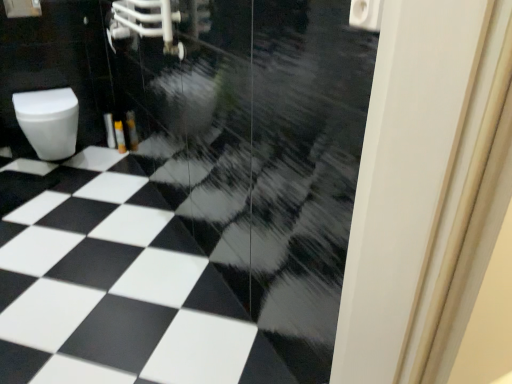
What do you see at coordinates (412, 178) in the screenshot?
I see `white glossy door at right` at bounding box center [412, 178].

Describe the element at coordinates (110, 285) in the screenshot. I see `black glossy tile at center` at that location.

Locate an element on the screen. white glossy door at right is located at coordinates (412, 178).

From a real-world perspective, is white glossy door at right located beneath white glossy toilet at left?

No, from a real-world perspective, white glossy door at right is not beneath white glossy toilet at left.

Is white glossy door at right to the right of white glossy toilet at left from the viewer's perspective?

Indeed, white glossy door at right is positioned on the right side of white glossy toilet at left.

Are white glossy door at right and white glossy toilet at left far apart?

white glossy door at right is far away from white glossy toilet at left.

Does point (383, 291) lie behind point (27, 107)?

No.

Is white glossy toilet at left oriented towards white glossy door at right?

Yes, white glossy toilet at left is turned towards white glossy door at right.

From the image's perspective, is white glossy toilet at left above or below white glossy door at right?

From the image's perspective, white glossy toilet at left appears above white glossy door at right.

Is white glossy toilet at left spatially inside white glossy door at right, or outside of it?

white glossy toilet at left is spatially situated outside white glossy door at right.

Is white glossy toilet at left to the right of white glossy door at right from the viewer's perspective?

No, white glossy toilet at left is not to the right of white glossy door at right.

Can you confirm if white glossy toilet at left is positioned to the left of black glossy tile at center?

Yes.

You are a GUI agent. You are given a task and a screenshot of the screen. Output one action in this format:
    pyautogui.click(x=<x>, y=<y>)
    Task: Click on the tile that is under the white glossy toilet at left (from a real-world perspective)
    The height and width of the screenshot is (384, 512).
    Given the screenshot: What is the action you would take?
    pyautogui.click(x=110, y=285)

Which of these two, white glossy toilet at left or black glossy tile at center, is thinner?

With smaller width is white glossy toilet at left.

Consider the image. From a real-world perspective, which object stands above the other?

white glossy toilet at left.

Is point (406, 78) positioned behind point (3, 286)?

No, (406, 78) is closer to viewer.

Is black glossy tile at center inside white glossy door at right?

No, white glossy door at right does not contain black glossy tile at center.

Is white glossy door at right smaller than black glossy tile at center?

Correct, white glossy door at right occupies less space than black glossy tile at center.

Can you confirm if white glossy door at right is shorter than black glossy tile at center?

No.

Which is in front, black glossy tile at center or white glossy toilet at left?

black glossy tile at center is more forward.

Considering the relative sizes of black glossy tile at center and white glossy toilet at left in the image provided, is black glossy tile at center shorter than white glossy toilet at left?

Indeed, black glossy tile at center has a lesser height compared to white glossy toilet at left.

Is black glossy tile at center far away from white glossy toilet at left?

That's not correct — black glossy tile at center is a little close to white glossy toilet at left.

From a real-world perspective, does black glossy tile at center sit lower than white glossy toilet at left?

Yes, from a real-world perspective, black glossy tile at center is below white glossy toilet at left.

From a real-world perspective, between white glossy toilet paper at upper right and white glossy door at right, who is vertically lower?

white glossy door at right, from a real-world perspective.

Considering their positions, is white glossy toilet paper at upper right located in front of or behind white glossy door at right?

white glossy toilet paper at upper right is behind white glossy door at right.

Looking at the image, does white glossy toilet paper at upper right seem bigger or smaller compared to white glossy door at right?

Considering their sizes, white glossy toilet paper at upper right takes up less space than white glossy door at right.

From the image's perspective, between black glossy tile at center and white glossy door at right, which one is located above?

white glossy door at right.

Where is `screen door on the right of black glossy tile at center`? The height and width of the screenshot is (384, 512). screen door on the right of black glossy tile at center is located at coordinates (412, 178).

Is black glossy tile at center smaller than white glossy door at right?

Actually, black glossy tile at center might be larger than white glossy door at right.

In the scene shown: Which of these two, black glossy tile at center or white glossy door at right, stands shorter?

black glossy tile at center.

Where is `toilet above the white glossy door at right (from the image's perspective)`? This screenshot has height=384, width=512. toilet above the white glossy door at right (from the image's perspective) is located at coordinates (49, 121).

The width and height of the screenshot is (512, 384). I want to click on toilet on the left of white glossy door at right, so click(x=49, y=121).

From the image, which object appears to be farther from white glossy toilet at left, white glossy toilet paper at upper right or white glossy door at right?

white glossy door at right.

In the scene shown: Which object lies nearer to the anchor point white glossy door at right, black glossy tile at center or white glossy toilet at left?

black glossy tile at center is closer to white glossy door at right.

From the image, which object appears to be farther from white glossy door at right, black glossy tile at center or white glossy toilet paper at upper right?

The object further to white glossy door at right is black glossy tile at center.

When comparing their distances from white glossy toilet at left, does black glossy tile at center or white glossy toilet paper at upper right seem closer?

black glossy tile at center is positioned closer to the anchor white glossy toilet at left.

Considering their positions, is white glossy door at right positioned closer to white glossy toilet at left than white glossy toilet paper at upper right?

The object closer to white glossy toilet at left is white glossy toilet paper at upper right.

Estimate the real-world distances between objects in this image. Which object is further from white glossy door at right, white glossy toilet paper at upper right or black glossy tile at center?

Among the two, black glossy tile at center is located further to white glossy door at right.

From the image, which object appears to be farther from black glossy tile at center, white glossy toilet at left or white glossy door at right?

The object further to black glossy tile at center is white glossy door at right.

Which object lies further to the anchor point black glossy tile at center, white glossy toilet paper at upper right or white glossy door at right?

The object further to black glossy tile at center is white glossy toilet paper at upper right.

In order to click on tile between white glossy toilet paper at upper right and white glossy toilet at left in the front-back direction in this screenshot , I will do `click(110, 285)`.

In order to click on toilet paper located between white glossy door at right and white glossy toilet at left in the depth direction in this screenshot , I will do `click(366, 14)`.

I want to click on toilet paper between black glossy tile at center and white glossy door at right from left to right, so click(366, 14).

In order to click on tile between white glossy toilet at left and white glossy door at right in this screenshot , I will do coord(110,285).